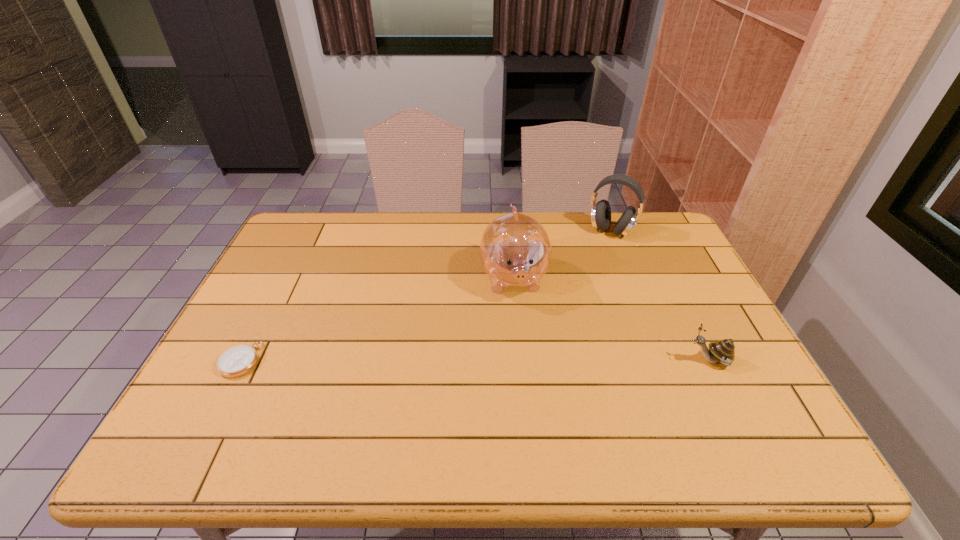
At what (x,y) coordinates should I click in order to perform the action: click on vacant point located between the compass and the farthest object. Please return your answer as a coordinate pair (x, y). Looking at the image, I should click on (426, 295).

At what (x,y) coordinates should I click in order to perform the action: click on unoccupied position between the snail and the farthest object. Please return your answer as a coordinate pair (x, y). This screenshot has height=540, width=960. Looking at the image, I should click on (660, 295).

This screenshot has width=960, height=540. I want to click on free area in between the compass and the headset, so click(426, 295).

The width and height of the screenshot is (960, 540). Find the location of `unoccupied area between the compass and the second shortest object`. unoccupied area between the compass and the second shortest object is located at coordinates (475, 360).

Image resolution: width=960 pixels, height=540 pixels. In order to click on blank region between the shortest object and the farthest object in this screenshot , I will do `click(426, 295)`.

This screenshot has width=960, height=540. In order to click on empty space between the third nearest object and the shortest object in this screenshot , I will do `click(377, 319)`.

The width and height of the screenshot is (960, 540). Find the location of `vacant space that's between the compass and the third nearest object`. vacant space that's between the compass and the third nearest object is located at coordinates (377, 319).

Select which object appears as the closest to the third tallest object. Please provide its 2D coordinates. Your answer should be formatted as a tuple, i.e. [(x, y)], where the tuple contains the x and y coordinates of a point satisfying the conditions above.

[(515, 250)]

Locate an element on the screen. The height and width of the screenshot is (540, 960). object identified as the second closest to the second object from left to right is located at coordinates (723, 351).

At what (x,y) coordinates should I click in order to perform the action: click on vacant region that satisfies the following two spatial constraints: 1. on the back side of the second object from left to right; 2. on the left side of the farthest object. Please return your answer as a coordinate pair (x, y). Looking at the image, I should click on (510, 231).